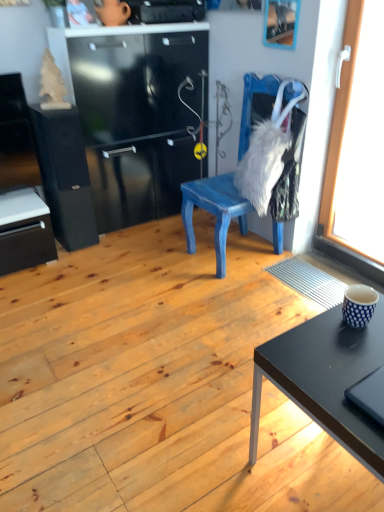
Question: Considering their positions, is black matte file cabinet at left located in front of or behind wooden picture frame at upper center?

Choices:
 (A) behind
 (B) front

Answer: (A)

Question: In the image, is black matte file cabinet at left on the left side or the right side of wooden picture frame at upper center?

Choices:
 (A) right
 (B) left

Answer: (B)

Question: Estimate the real-world distances between objects in this image. Which object is closer to the blue painted wood chair at center?

Choices:
 (A) blue dotted cup at right
 (B) transparent glass window at right
 (C) black matte desk at lower right
 (D) wooden picture frame at upper center
 (E) black matte file cabinet at left

Answer: (B)

Question: Which object is positioned closest to the black matte desk at lower right?

Choices:
 (A) wooden picture frame at upper center
 (B) black matte laptop at lower right
 (C) blue painted wood chair at center
 (D) blue dotted cup at right
 (E) black matte file cabinet at left

Answer: (B)